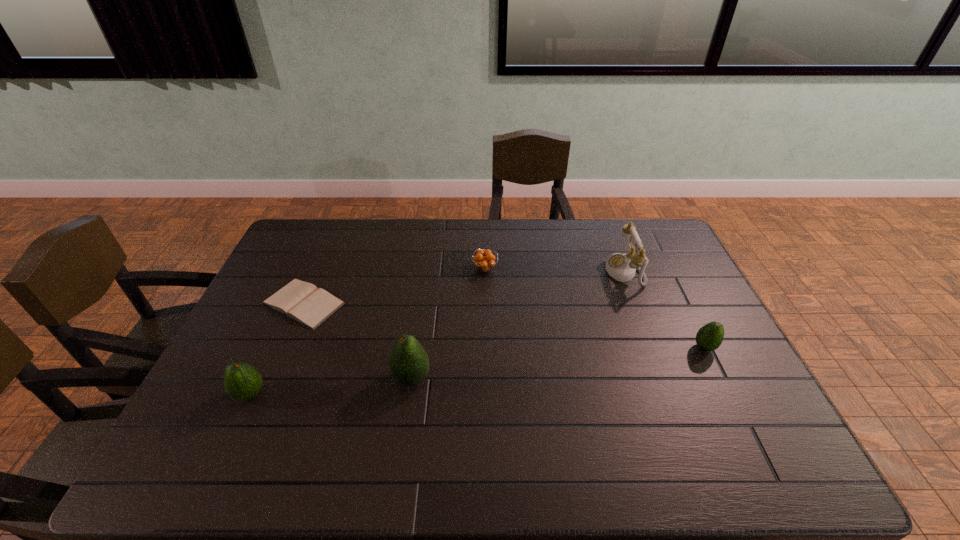
Find the location of a particular element. the second tallest avocado is located at coordinates (242, 381).

The height and width of the screenshot is (540, 960). Find the location of `the third tallest object`. the third tallest object is located at coordinates tap(242, 381).

You are a GUI agent. You are given a task and a screenshot of the screen. Output one action in this format:
    pyautogui.click(x=<x>, y=<y>)
    Task: Click on the second avocado from right to left
    
    Given the screenshot: What is the action you would take?
    pyautogui.click(x=409, y=363)

Where is `the third object from left to right`? The height and width of the screenshot is (540, 960). the third object from left to right is located at coordinates (409, 363).

Find the location of a particular element. the rightmost avocado is located at coordinates [709, 337].

Locate an element on the screen. This screenshot has width=960, height=540. the shortest avocado is located at coordinates (709, 337).

Where is `telephone`? telephone is located at coordinates (622, 267).

Where is `the fourth object from left to right`? Image resolution: width=960 pixels, height=540 pixels. the fourth object from left to right is located at coordinates (484, 260).

You are a GUI agent. You are given a task and a screenshot of the screen. Output one action in this format:
    pyautogui.click(x=<x>, y=<y>)
    Task: Click on the second shortest object
    
    Given the screenshot: What is the action you would take?
    pyautogui.click(x=484, y=260)

Where is `the shortest object`? the shortest object is located at coordinates point(301,301).